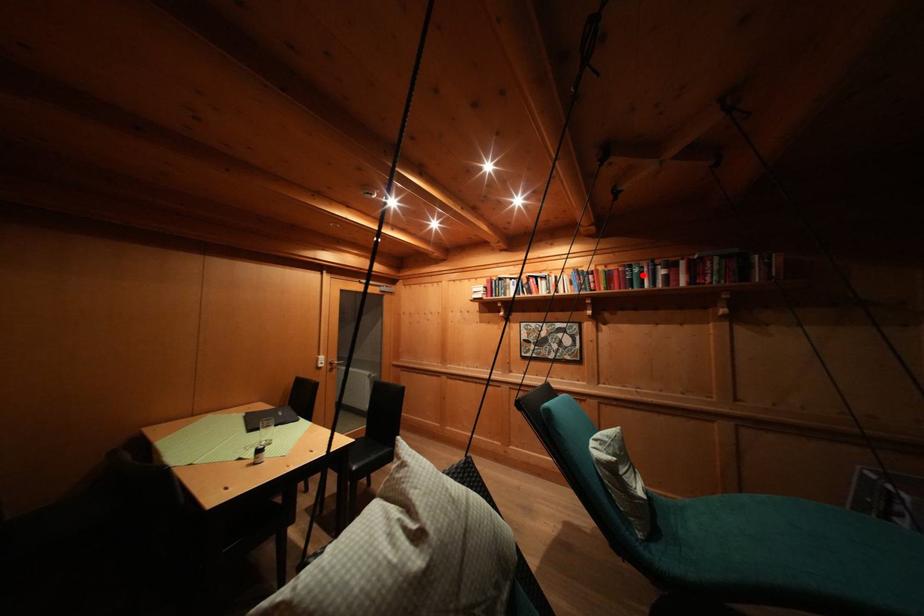
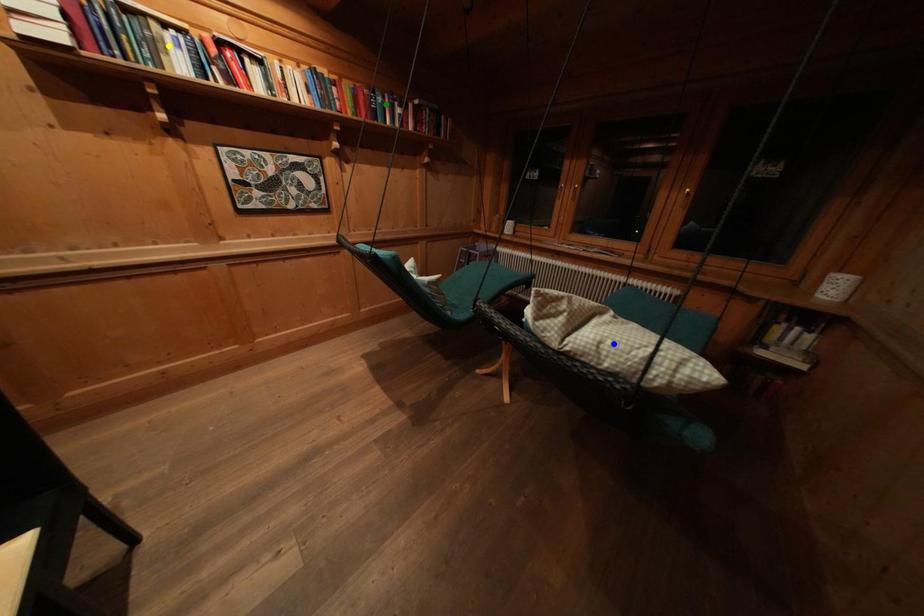
Question: I am providing you with two images of the same scene from different viewpoints. A red point is marked on the first image. You are given multiple points on the second image. Which point in image 2 represents the same 3d spot as the red point in image 1?

Choices:
 (A) yellow point
 (B) blue point
 (C) green point

Answer: (C)